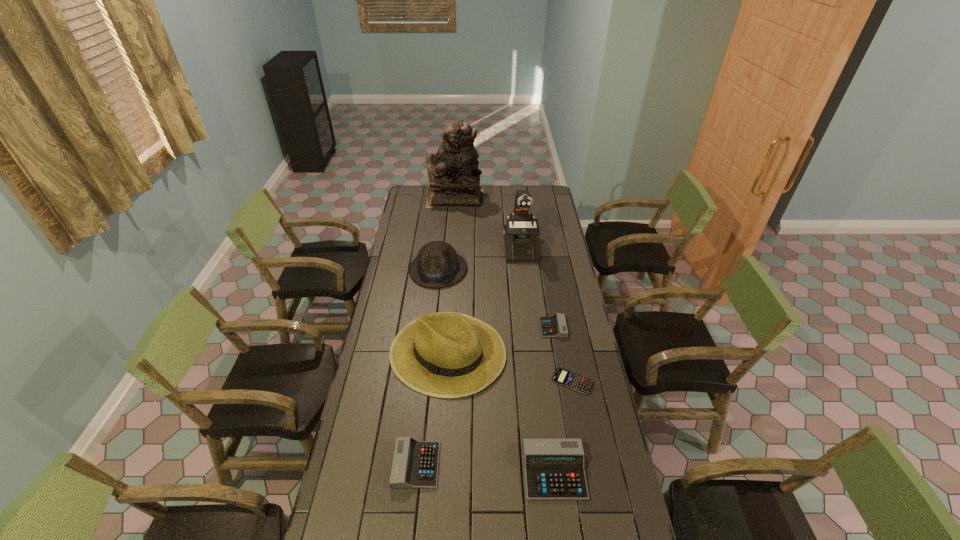
This screenshot has height=540, width=960. I want to click on the fourth closest calculator to the microscope, so click(x=415, y=463).

At what (x,y) coordinates should I click in order to perform the action: click on the second closest calculator to the farthest gray calculator. Please return your answer as a coordinate pair (x, y). The image size is (960, 540). Looking at the image, I should click on (554, 469).

Where is `gray calculator that is the closest to the tallest calculator`? Image resolution: width=960 pixels, height=540 pixels. gray calculator that is the closest to the tallest calculator is located at coordinates (415, 463).

Where is `the second closest gray calculator to the sculpture`? the second closest gray calculator to the sculpture is located at coordinates (415, 463).

Where is `vacant space that satisfies the following two spatial constraints: 1. through the eyepieces of the microscope; 2. on the right side of the fifth tallest object`? vacant space that satisfies the following two spatial constraints: 1. through the eyepieces of the microscope; 2. on the right side of the fifth tallest object is located at coordinates (546, 471).

Locate an element on the screen. free location that satisfies the following two spatial constraints: 1. through the eyepieces of the shortest object; 2. on the right side of the microscope is located at coordinates (536, 381).

Where is `free region that satisfies the following two spatial constraints: 1. on the front side of the black sunhat; 2. on the right side of the fourth shortest object`? The height and width of the screenshot is (540, 960). free region that satisfies the following two spatial constraints: 1. on the front side of the black sunhat; 2. on the right side of the fourth shortest object is located at coordinates (440, 471).

Identify the location of vacant space that satisfies the following two spatial constraints: 1. on the front-facing side of the biggest gray calculator; 2. on the right side of the fifth shortest object. The image size is (960, 540). (416, 471).

What are the coordinates of `free space that satisfies the following two spatial constraints: 1. through the eyepieces of the fifth tallest object; 2. on the left side of the seventh shortest object` in the screenshot? It's located at (546, 471).